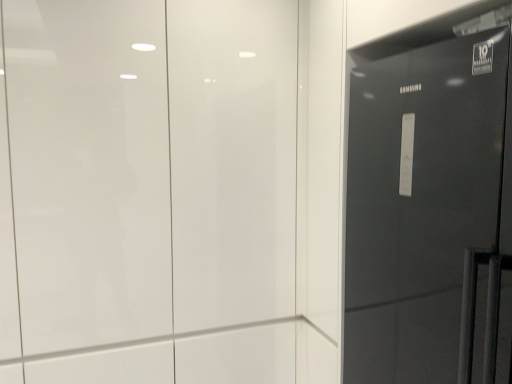
Question: Relative to white glossy door at upper center, acting as the 2th door starting from the right, is glossy black refrigerator at right, which is the second door in left-to-right order, in front or behind?

Choices:
 (A) behind
 (B) front

Answer: (B)

Question: From a real-world perspective, is glossy black refrigerator at right, which is the second door in left-to-right order, above or below white glossy door at upper center, the first door in the left-to-right sequence?

Choices:
 (A) above
 (B) below

Answer: (B)

Question: Visually, is glossy black refrigerator at right, which is the second door in left-to-right order, positioned to the left or to the right of white glossy door at upper center, acting as the 2th door starting from the right?

Choices:
 (A) right
 (B) left

Answer: (A)

Question: Is point (39, 124) closer or farther from the camera than point (465, 71)?

Choices:
 (A) farther
 (B) closer

Answer: (A)

Question: From a real-world perspective, is white glossy door at upper center, the first door in the left-to-right sequence, above or below glossy black refrigerator at right, which appears as the 1th door when viewed from the right?

Choices:
 (A) below
 (B) above

Answer: (B)

Question: From the image's perspective, is white glossy door at upper center, acting as the 2th door starting from the right, above or below glossy black refrigerator at right, which appears as the 1th door when viewed from the right?

Choices:
 (A) below
 (B) above

Answer: (B)

Question: Relative to glossy black refrigerator at right, which appears as the 1th door when viewed from the right, is white glossy door at upper center, the first door in the left-to-right sequence, in front or behind?

Choices:
 (A) front
 (B) behind

Answer: (B)